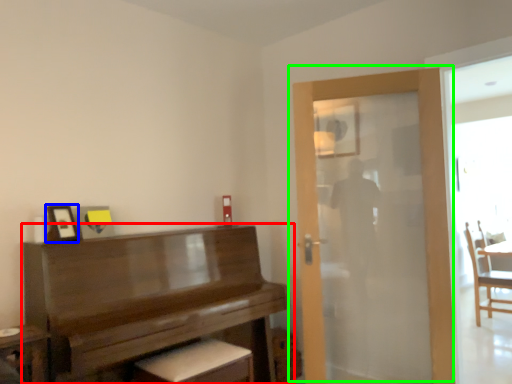
Question: Based on their relative distances, which object is farther from piano (highlighted by a red box)? Choose from picture frame (highlighted by a blue box) and door (highlighted by a green box).

Choices:
 (A) picture frame
 (B) door

Answer: (B)